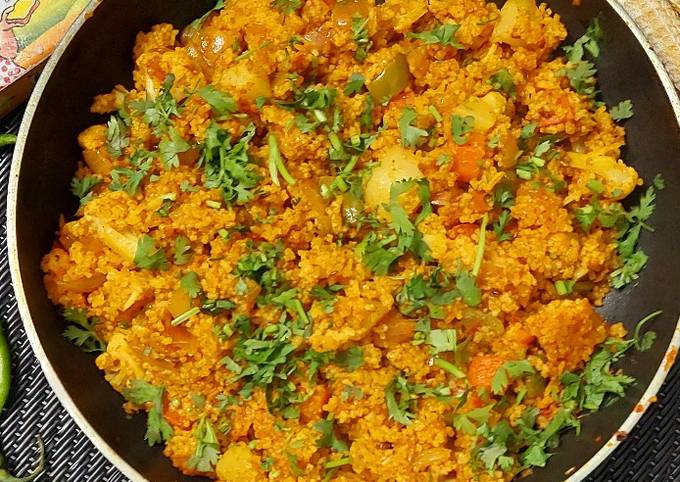
The image size is (680, 482). I want to click on coaster for drink, so tap(58, 26).